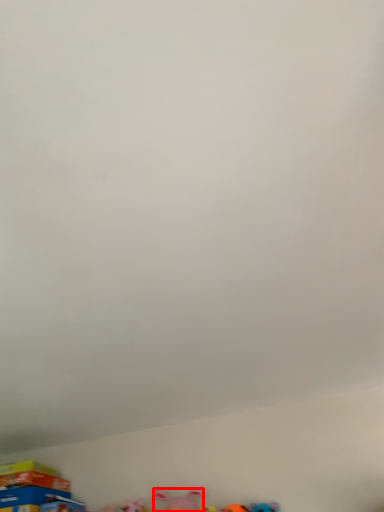
Question: Where is toy (annotated by the red box) located in relation to toy in the image?

Choices:
 (A) left
 (B) right

Answer: (B)